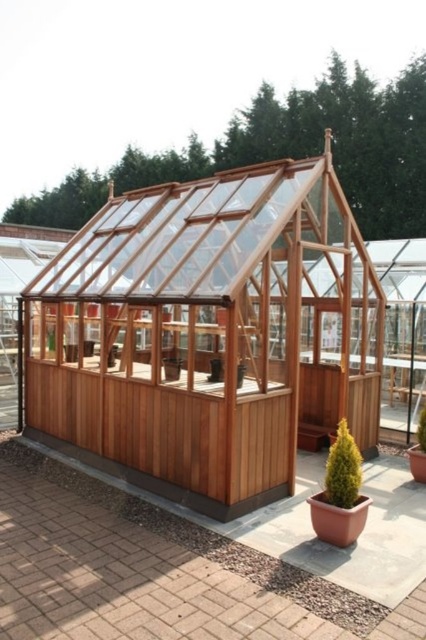
Question: Which point is farther to the camera?

Choices:
 (A) click(x=420, y=419)
 (B) click(x=348, y=465)

Answer: (A)

Question: Is green textured cone at lower right smaller than green matte potted plant at center?

Choices:
 (A) yes
 (B) no

Answer: (B)

Question: Which point is farther from the camera taking this photo?

Choices:
 (A) (345, 461)
 (B) (420, 442)

Answer: (B)

Question: Can you confirm if green textured cone at lower right is positioned to the right of green matte potted plant at center?

Choices:
 (A) yes
 (B) no

Answer: (B)

Question: Is green textured cone at lower right to the right of green matte potted plant at center from the viewer's perspective?

Choices:
 (A) no
 (B) yes

Answer: (A)